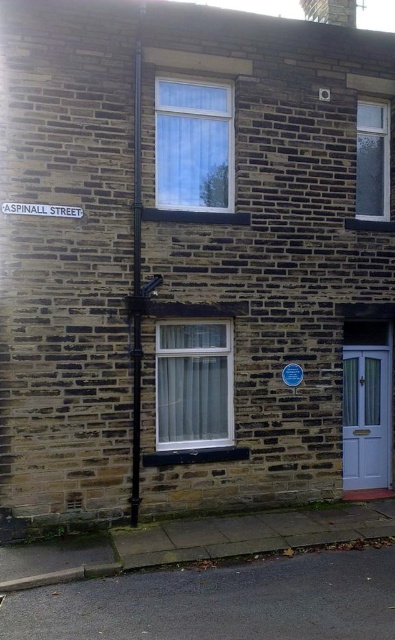
Does white glossy door at lower right lie behind metallic pole at center?

Yes, it is behind metallic pole at center.

Can you confirm if white glossy door at lower right is positioned to the left of metallic pole at center?

Incorrect, white glossy door at lower right is not on the left side of metallic pole at center.

Locate an element on the screen. This screenshot has height=640, width=395. white glossy door at lower right is located at coordinates (366, 417).

The height and width of the screenshot is (640, 395). I want to click on white glossy door at lower right, so click(x=366, y=417).

Does metallic pole at center appear on the left side of white plastic street sign at upper left?

In fact, metallic pole at center is to the right of white plastic street sign at upper left.

Does metallic pole at center have a lesser width compared to white plastic street sign at upper left?

Yes, metallic pole at center is thinner than white plastic street sign at upper left.

Describe the element at coordinates (137, 276) in the screenshot. I see `metallic pole at center` at that location.

The height and width of the screenshot is (640, 395). I want to click on metallic pole at center, so click(x=137, y=276).

Does white glossy door at lower right have a smaller size compared to white plastic street sign at upper left?

Incorrect, white glossy door at lower right is not smaller in size than white plastic street sign at upper left.

What do you see at coordinates (366, 417) in the screenshot? I see `white glossy door at lower right` at bounding box center [366, 417].

Identify the location of white glossy door at lower right. (x=366, y=417).